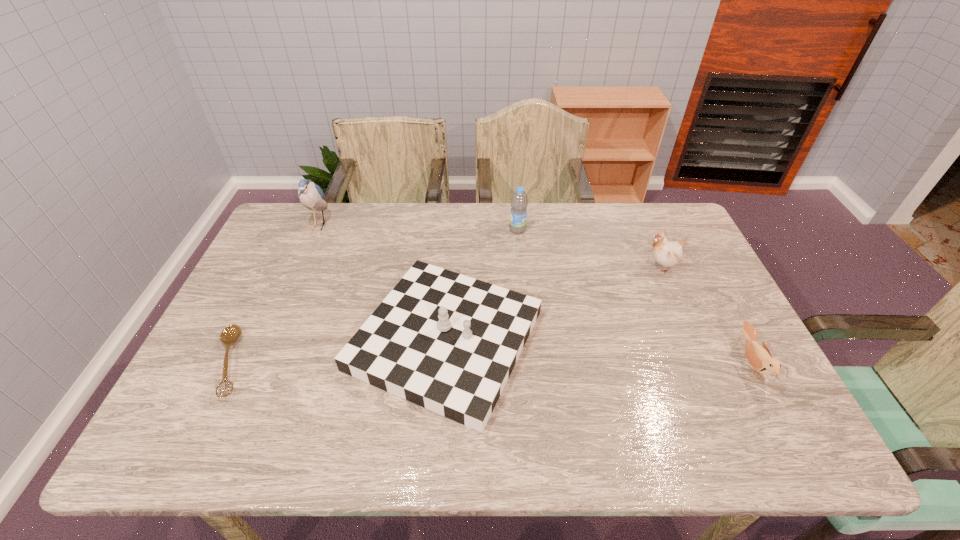
Locate an element on the screen. The height and width of the screenshot is (540, 960). the tallest bird is located at coordinates (311, 195).

This screenshot has width=960, height=540. I want to click on the leftmost bird, so click(x=311, y=195).

I want to click on the second tallest object, so coord(519,202).

Identify the location of the second farthest bird. (667, 253).

At what (x,y) coordinates should I click in order to perform the action: click on the second object from right to left. Please return your answer as a coordinate pair (x, y). This screenshot has width=960, height=540. Looking at the image, I should click on (667, 253).

In order to click on checkerboard in this screenshot , I will do `click(444, 341)`.

Identify the location of the second shortest object. The image size is (960, 540). (760, 358).

At what (x,y) coordinates should I click in order to perform the action: click on the rightmost bird. Please return your answer as a coordinate pair (x, y). The image size is (960, 540). Looking at the image, I should click on click(x=760, y=358).

Locate an element on the screen. Image resolution: width=960 pixels, height=540 pixels. the shortest object is located at coordinates (231, 333).

The height and width of the screenshot is (540, 960). I want to click on free space located at the tip of the farthest bird's beak, so click(x=352, y=225).